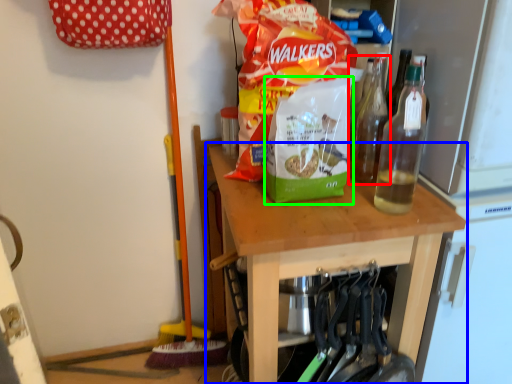
Question: Which object is the closest to the bottle (highlighted by a red box)? Choose among these: table (highlighted by a blue box) or waste (highlighted by a green box).

Choices:
 (A) table
 (B) waste

Answer: (B)